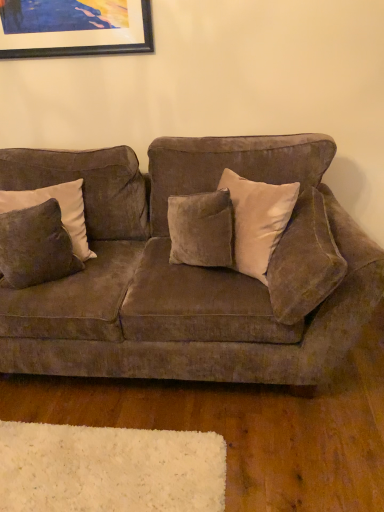
What is the approximate width of suede pillow at right, the first pillow from the right?

suede pillow at right, the first pillow from the right, is 25.50 centimeters wide.

Describe the element at coordinates (179, 273) in the screenshot. This screenshot has height=512, width=384. I see `velvet brown couch at center` at that location.

This screenshot has width=384, height=512. Identify the location of velvet brown couch at center. (179, 273).

What are the coordinates of `wooden picture frame at upper left` in the screenshot? It's located at (74, 28).

Based on their sizes in the image, would you say suede pillow at right, positioned as the second pillow in left-to-right order, is bigger or smaller than wooden picture frame at upper left?

suede pillow at right, positioned as the second pillow in left-to-right order, is bigger than wooden picture frame at upper left.

Considering the relative sizes of suede pillow at right, the first pillow from the right, and wooden picture frame at upper left in the image provided, is suede pillow at right, the first pillow from the right, shorter than wooden picture frame at upper left?

No.

In the scene shown: From the image's perspective, is suede pillow at right, positioned as the second pillow in left-to-right order, located above or below wooden picture frame at upper left?

From the image's perspective, suede pillow at right, positioned as the second pillow in left-to-right order, appears below wooden picture frame at upper left.

How different are the orientations of suede pillow at right, positioned as the second pillow in left-to-right order, and wooden picture frame at upper left in degrees?

The angle between the facing direction of suede pillow at right, positioned as the second pillow in left-to-right order, and the facing direction of wooden picture frame at upper left is 87 degrees.

From the image's perspective, is wooden picture frame at upper left over velvet brown pillow at left, placed as the 2th pillow when sorted from right to left?

Indeed, from the image's perspective, wooden picture frame at upper left is shown above velvet brown pillow at left, placed as the 2th pillow when sorted from right to left.

Is wooden picture frame at upper left in contact with velvet brown pillow at left, placed as the 2th pillow when sorted from right to left?

There is a gap between wooden picture frame at upper left and velvet brown pillow at left, placed as the 2th pillow when sorted from right to left.

Is wooden picture frame at upper left oriented towards velvet brown pillow at left, placed as the 2th pillow when sorted from right to left?

No, wooden picture frame at upper left is not turned towards velvet brown pillow at left, placed as the 2th pillow when sorted from right to left.

Is suede pillow at right, positioned as the second pillow in left-to-right order, further to camera compared to velvet brown couch at center?

Yes.

From a real-world perspective, is suede pillow at right, the first pillow from the right, positioned over velvet brown couch at center based on gravity?

Correct, in the physical world, suede pillow at right, the first pillow from the right, is higher than velvet brown couch at center.

From the image's perspective, between suede pillow at right, the first pillow from the right, and velvet brown couch at center, who is located below?

From the image's view, velvet brown couch at center is below.

Can you confirm if suede pillow at right, positioned as the second pillow in left-to-right order, is taller than velvet brown couch at center?

No, suede pillow at right, positioned as the second pillow in left-to-right order, is not taller than velvet brown couch at center.

Is there a large distance between velvet brown couch at center and suede pillow at right, positioned as the second pillow in left-to-right order?

No, velvet brown couch at center is not far away from suede pillow at right, positioned as the second pillow in left-to-right order.

At what (x,y) coordinates should I click in order to perform the action: click on studio couch that is on the left side of suede pillow at right, the first pillow from the right. Please return your answer as a coordinate pair (x, y). Looking at the image, I should click on (179, 273).

Does velvet brown couch at center have a smaller size compared to suede pillow at right, positioned as the second pillow in left-to-right order?

No.

What's the angular difference between velvet brown couch at center and suede pillow at right, the first pillow from the right,'s facing directions?

The facing directions of velvet brown couch at center and suede pillow at right, the first pillow from the right, are 87 degrees apart.

Which is in front, wooden picture frame at upper left or velvet brown couch at center?

velvet brown couch at center is closer to the camera.

Does wooden picture frame at upper left have a smaller size compared to velvet brown couch at center?

Correct, wooden picture frame at upper left occupies less space than velvet brown couch at center.

From the image's perspective, is wooden picture frame at upper left above velvet brown couch at center?

Indeed, from the image's perspective, wooden picture frame at upper left is shown above velvet brown couch at center.

Considering the positions of objects velvet brown pillow at left, placed as the 2th pillow when sorted from right to left, and velvet brown couch at center in the image provided, who is behind, velvet brown pillow at left, placed as the 2th pillow when sorted from right to left, or velvet brown couch at center?

Positioned behind is velvet brown pillow at left, placed as the 2th pillow when sorted from right to left.

Can you confirm if velvet brown pillow at left, placed as the 2th pillow when sorted from right to left, is positioned to the right of velvet brown couch at center?

No, velvet brown pillow at left, placed as the 2th pillow when sorted from right to left, is not to the right of velvet brown couch at center.

Between velvet brown pillow at left, placed as the 2th pillow when sorted from right to left, and velvet brown couch at center, which one has larger size?

velvet brown couch at center is bigger.

Is velvet brown pillow at left, placed as the 2th pillow when sorted from right to left, facing towards velvet brown couch at center?

Yes.

From a real-world perspective, is wooden picture frame at upper left positioned above or below suede pillow at right, the first pillow from the right?

In terms of real-world spatial position, wooden picture frame at upper left is above suede pillow at right, the first pillow from the right.

Is wooden picture frame at upper left oriented away from suede pillow at right, the first pillow from the right?

No, wooden picture frame at upper left's orientation is not away from suede pillow at right, the first pillow from the right.

Considering the sizes of objects wooden picture frame at upper left and suede pillow at right, positioned as the second pillow in left-to-right order, in the image provided, who is bigger, wooden picture frame at upper left or suede pillow at right, positioned as the second pillow in left-to-right order,?

suede pillow at right, positioned as the second pillow in left-to-right order.

This screenshot has width=384, height=512. I want to click on picture frame that is behind the suede pillow at right, positioned as the second pillow in left-to-right order, so click(74, 28).

At what (x,y) coordinates should I click in order to perform the action: click on pillow on the right of wooden picture frame at upper left. Please return your answer as a coordinate pair (x, y). Looking at the image, I should click on (304, 261).

Where is `picture frame lying above the velvet brown pillow at left, which ranks as the first pillow in left-to-right order (from the image's perspective)`? picture frame lying above the velvet brown pillow at left, which ranks as the first pillow in left-to-right order (from the image's perspective) is located at coordinates (74, 28).

From the image, which object appears to be nearer to velvet brown pillow at left, placed as the 2th pillow when sorted from right to left, suede pillow at right, positioned as the second pillow in left-to-right order, or wooden picture frame at upper left?

wooden picture frame at upper left is positioned closer to the anchor velvet brown pillow at left, placed as the 2th pillow when sorted from right to left.

Which object lies nearer to the anchor point wooden picture frame at upper left, suede pillow at right, positioned as the second pillow in left-to-right order, or velvet brown couch at center?

velvet brown couch at center lies closer to wooden picture frame at upper left than the other object.

Based on the photo, from the image, which object appears to be farther from wooden picture frame at upper left, velvet brown couch at center or suede pillow at right, positioned as the second pillow in left-to-right order?

suede pillow at right, positioned as the second pillow in left-to-right order, is further to wooden picture frame at upper left.

Considering their positions, is wooden picture frame at upper left positioned further to suede pillow at right, the first pillow from the right, than velvet brown couch at center?

wooden picture frame at upper left is further to suede pillow at right, the first pillow from the right.

Considering their positions, is suede pillow at right, positioned as the second pillow in left-to-right order, positioned further to velvet brown couch at center than wooden picture frame at upper left?

wooden picture frame at upper left lies further to velvet brown couch at center than the other object.

When comparing their distances from velvet brown couch at center, does suede pillow at right, positioned as the second pillow in left-to-right order, or velvet brown pillow at left, which ranks as the first pillow in left-to-right order, seem closer?

Based on the image, suede pillow at right, positioned as the second pillow in left-to-right order, appears to be nearer to velvet brown couch at center.

Estimate the real-world distances between objects in this image. Which object is closer to suede pillow at right, the first pillow from the right, wooden picture frame at upper left or velvet brown pillow at left, which ranks as the first pillow in left-to-right order?

Among the two, velvet brown pillow at left, which ranks as the first pillow in left-to-right order, is located nearer to suede pillow at right, the first pillow from the right.

Estimate the real-world distances between objects in this image. Which object is further from velvet brown pillow at left, placed as the 2th pillow when sorted from right to left, wooden picture frame at upper left or suede pillow at right, the first pillow from the right?

The object further to velvet brown pillow at left, placed as the 2th pillow when sorted from right to left, is suede pillow at right, the first pillow from the right.

Identify the location of studio couch between velvet brown pillow at left, placed as the 2th pillow when sorted from right to left, and suede pillow at right, positioned as the second pillow in left-to-right order. (179, 273).

The width and height of the screenshot is (384, 512). Identify the location of picture frame between velvet brown pillow at left, which ranks as the first pillow in left-to-right order, and suede pillow at right, the first pillow from the right. (74, 28).